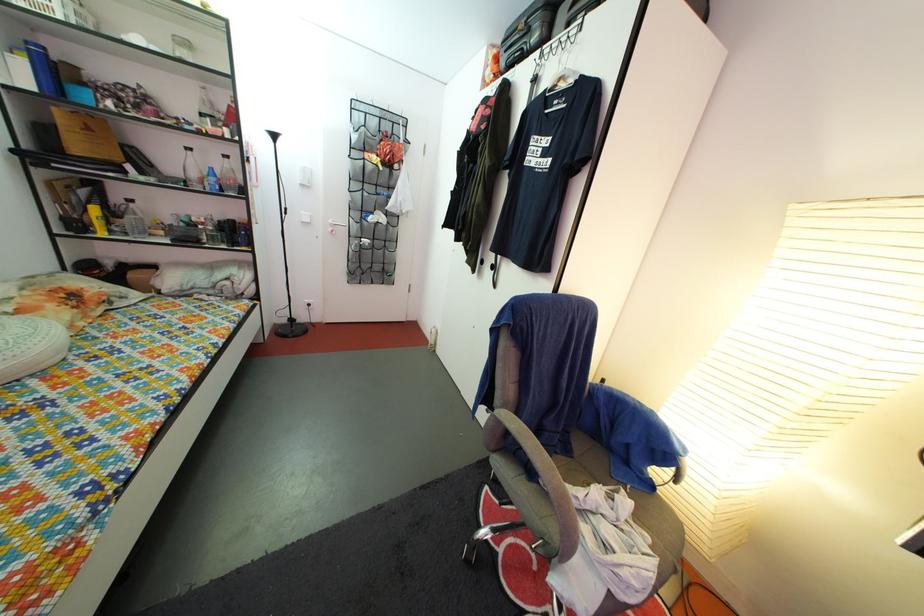
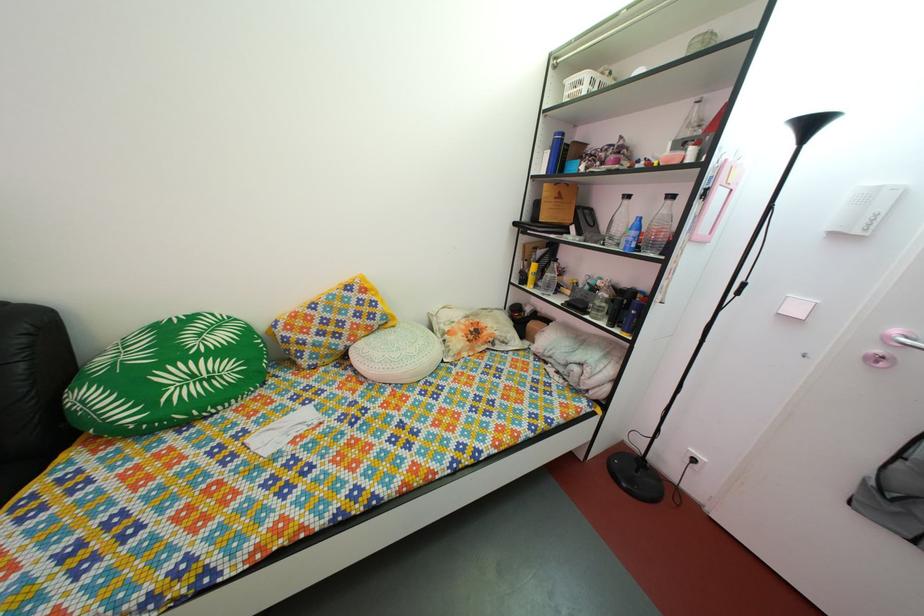
Find the pixel in the second image that matches (x=169, y=182) in the first image.

(608, 241)